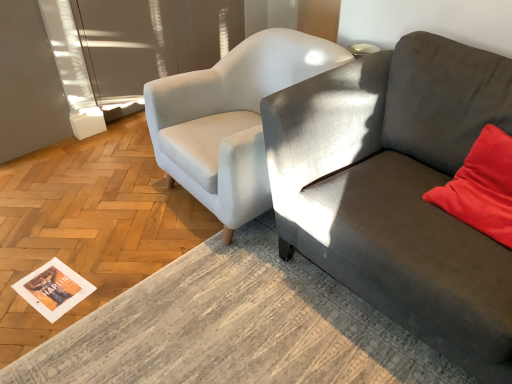
Question: Can you confirm if white fabric chair at center is taller than transparent glass door at upper left?

Choices:
 (A) no
 (B) yes

Answer: (A)

Question: From the image's perspective, is white fabric chair at center below transparent glass door at upper left?

Choices:
 (A) no
 (B) yes

Answer: (B)

Question: Is white fabric chair at center far away from transparent glass door at upper left?

Choices:
 (A) no
 (B) yes

Answer: (B)

Question: Is white fabric chair at center positioned behind transparent glass door at upper left?

Choices:
 (A) yes
 (B) no

Answer: (B)

Question: Does white fabric chair at center appear on the left side of transparent glass door at upper left?

Choices:
 (A) yes
 (B) no

Answer: (B)

Question: Based on their sizes in the image, would you say transparent glass door at upper left is bigger or smaller than velvet red pillow at right?

Choices:
 (A) big
 (B) small

Answer: (A)

Question: Choose the correct answer: Is transparent glass door at upper left inside velvet red pillow at right or outside it?

Choices:
 (A) inside
 (B) outside

Answer: (B)

Question: Is point (205, 3) positioned closer to the camera than point (480, 142)?

Choices:
 (A) closer
 (B) farther

Answer: (B)

Question: From a real-world perspective, is transparent glass door at upper left positioned above or below velvet red pillow at right?

Choices:
 (A) above
 (B) below

Answer: (B)

Question: Based on their positions, is velvet red pillow at right located to the left or right of white paper magazine at lower left?

Choices:
 (A) left
 (B) right

Answer: (B)

Question: Would you say velvet red pillow at right is inside or outside white paper magazine at lower left?

Choices:
 (A) outside
 (B) inside

Answer: (A)

Question: Is velvet red pillow at right in front of or behind white paper magazine at lower left in the image?

Choices:
 (A) front
 (B) behind

Answer: (A)

Question: Is point (478, 208) positioned closer to the camera than point (66, 276)?

Choices:
 (A) farther
 (B) closer

Answer: (B)

Question: From the image's perspective, is white paper magazine at lower left positioned above or below textured gray couch at right?

Choices:
 (A) above
 (B) below

Answer: (B)

Question: From a real-world perspective, is white paper magazine at lower left positioned above or below textured gray couch at right?

Choices:
 (A) below
 (B) above

Answer: (A)